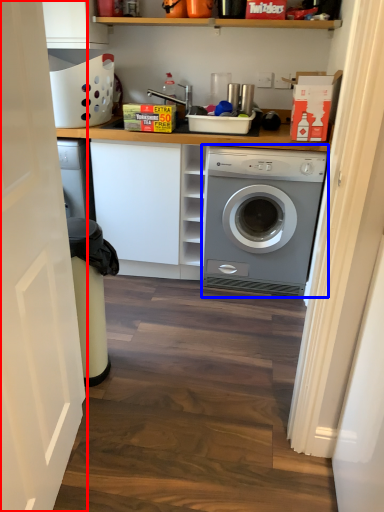
Question: Among these objects, which one is farthest to the camera, door (highlighted by a red box) or washing machine (highlighted by a blue box)?

Choices:
 (A) door
 (B) washing machine

Answer: (B)